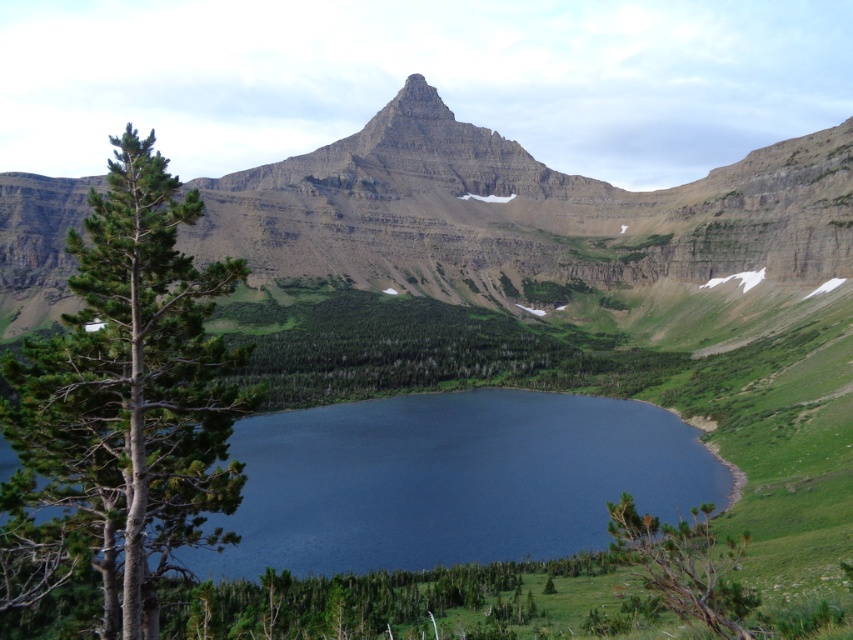
Question: Estimate the real-world distances between objects in this image. Which object is farther from the rugged rock mountain at center?

Choices:
 (A) deep blue water at center
 (B) green matte tree at lower right

Answer: (B)

Question: Is green needle-like tree at left wider than green matte tree at lower right?

Choices:
 (A) no
 (B) yes

Answer: (B)

Question: Is green needle-like tree at left behind green matte tree at lower right?

Choices:
 (A) no
 (B) yes

Answer: (A)

Question: Among these objects, which one is farthest from the camera?

Choices:
 (A) deep blue water at center
 (B) green needle-like tree at left

Answer: (A)

Question: From the image, what is the correct spatial relationship of deep blue water at center in relation to green needle-like tree at left?

Choices:
 (A) left
 (B) right

Answer: (B)

Question: Which of these objects is positioned farthest from the deep blue water at center?

Choices:
 (A) rugged rock mountain at center
 (B) green needle-like tree at left
 (C) green matte tree at lower right

Answer: (A)